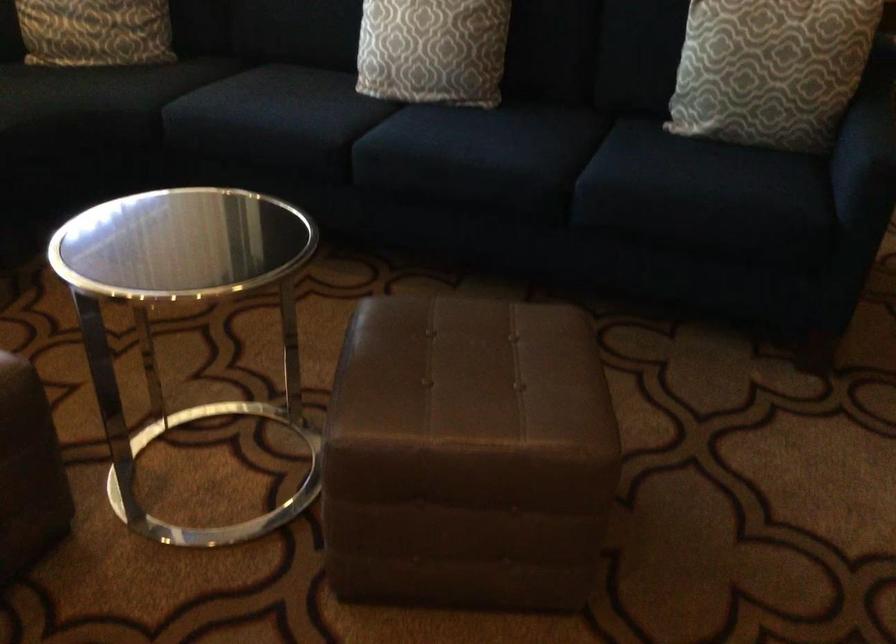
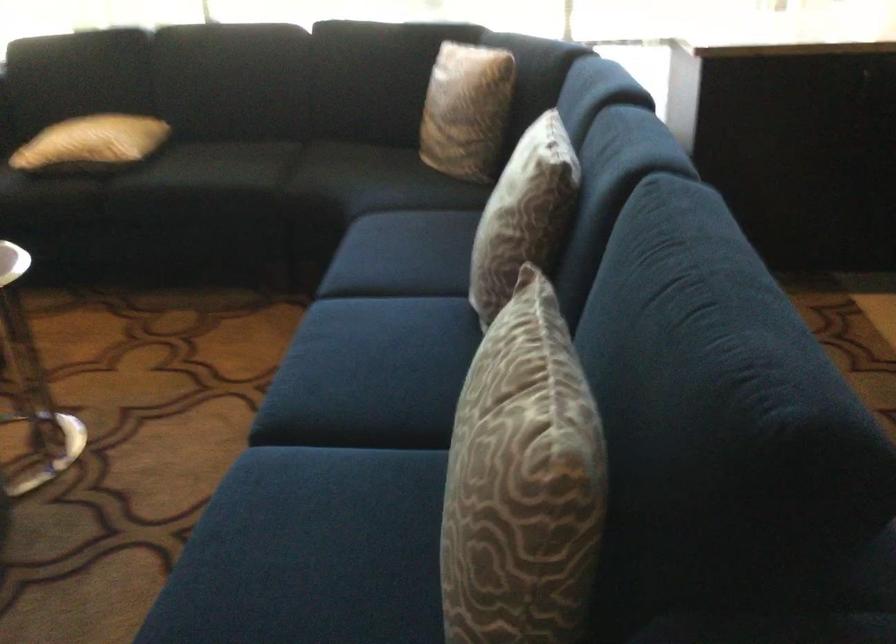
Find the pixel in the second image that matches (x=600, y=162) in the first image.

(341, 458)